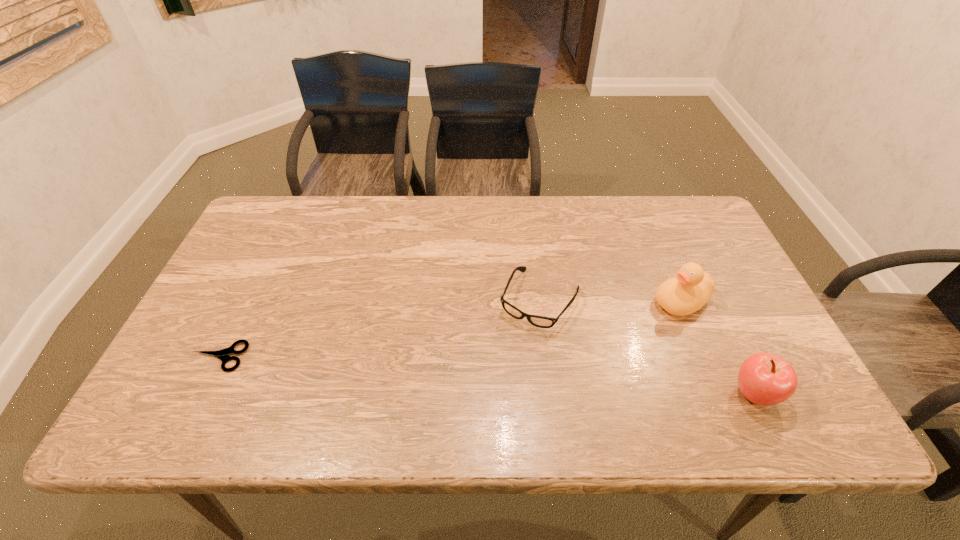
At what (x,y) coordinates should I click in order to perform the action: click on free space that satisfies the following two spatial constraints: 1. on the back side of the duck; 2. on the right side of the shears. Please return your answer as a coordinate pair (x, y). Looking at the image, I should click on (246, 302).

I want to click on vacant space that satisfies the following two spatial constraints: 1. on the front side of the nearest object; 2. on the right side of the shortest object, so click(201, 394).